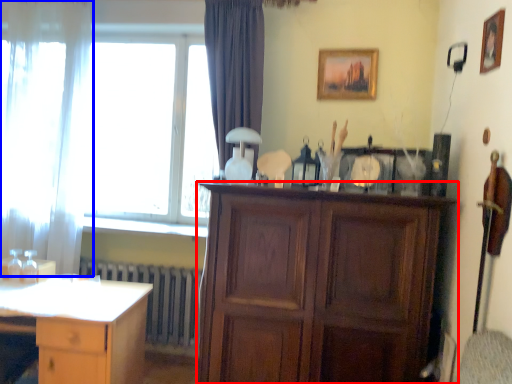
Question: Which point is closer to the camera, cabinetry (highlighted by a red box) or curtain (highlighted by a blue box)?

Choices:
 (A) cabinetry
 (B) curtain

Answer: (A)